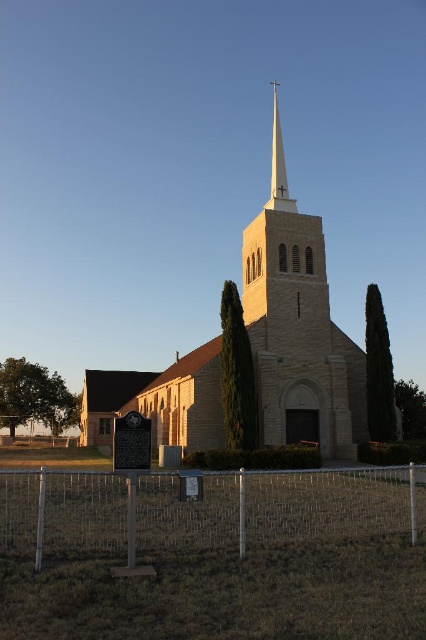
What is the 2D coordinate of the white smooth steeple at center in the image?

The white smooth steeple at center is located at the 2D coordinate point of (279, 164).

Consider the image. You are standing at the entrance of the beige stone church at center and want to take a photo of the green leafy tree at lower left. Can you see the tree clearly through the church windows?

The beige stone church at center is in front of the green leafy tree at lower left, so the church is blocking the view of the tree from the entrance. You won

You are a photographer planning to capture the beige stone church at center and the green leafy tree at lower left in a single wide shot. Based on their sizes, which object should you position closer to the camera to make them appear similar in size in the final photo?

The beige stone church at center is larger in size than the green leafy tree at lower left, so to make them appear similar in size in the photo, you should position the green leafy tree at lower left closer to the camera than the beige stone church at center.